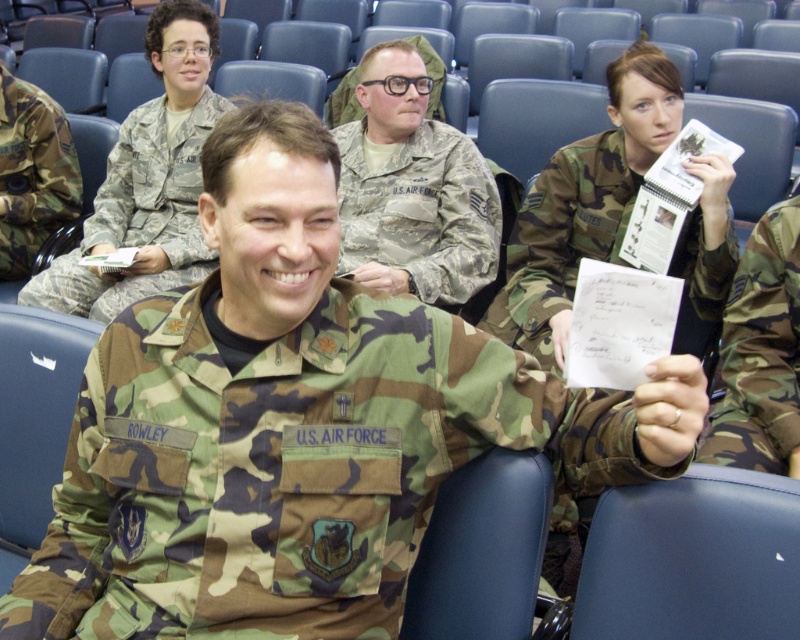
Question: Which of the following is the farthest from the observer?

Choices:
 (A) (430, 296)
 (B) (4, 211)
 (C) (724, 401)
 (D) (34, 291)

Answer: (B)

Question: Which is nearer to the camouflage fabric notebook at upper right?

Choices:
 (A) camouflage fabric uniform at center
 (B) camouflage uniform at center
 (C) camo fabric pants at lower right

Answer: (B)

Question: Is camouflage uniform at center positioned before camouflage fabric uniform at left?

Choices:
 (A) yes
 (B) no

Answer: (A)

Question: Is camouflage fabric notebook at upper right thinner than camo fabric pants at lower right?

Choices:
 (A) no
 (B) yes

Answer: (A)

Question: Considering the relative positions of camo fabric pants at lower right and camouflage fabric uniform at left in the image provided, where is camo fabric pants at lower right located with respect to camouflage fabric uniform at left?

Choices:
 (A) left
 (B) right

Answer: (B)

Question: Which object appears farthest from the camera in this image?

Choices:
 (A) camouflage fabric uniform at left
 (B) camouflage uniform at center
 (C) camo fabric pants at lower right
 (D) camouflage fabric notebook at upper right

Answer: (A)